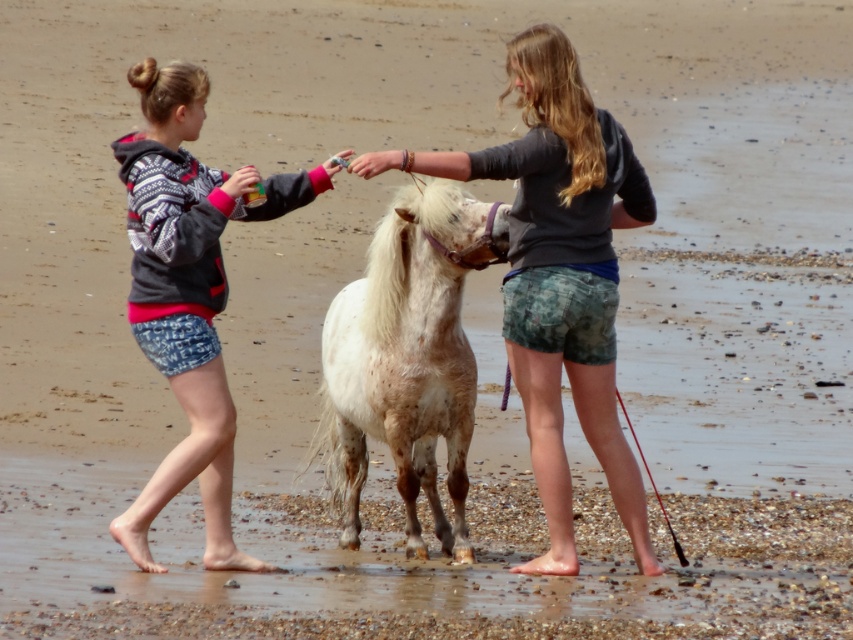
Question: Does spotted white pony at center have a smaller size compared to white speckled fur at center?

Choices:
 (A) no
 (B) yes

Answer: (A)

Question: Which is nearer to the patterned denim shorts at left?

Choices:
 (A) spotted white pony at center
 (B) white speckled fur at center

Answer: (B)

Question: Among these points, which one is nearest to the camera?

Choices:
 (A) (154, 248)
 (B) (514, 346)

Answer: (A)

Question: Does spotted white pony at center have a lesser width compared to patterned denim shorts at left?

Choices:
 (A) no
 (B) yes

Answer: (A)

Question: Estimate the real-world distances between objects in this image. Which object is farther from the spotted white pony at center?

Choices:
 (A) white speckled fur at center
 (B) patterned denim shorts at left

Answer: (B)

Question: Is spotted white pony at center positioned in front of patterned denim shorts at left?

Choices:
 (A) no
 (B) yes

Answer: (B)